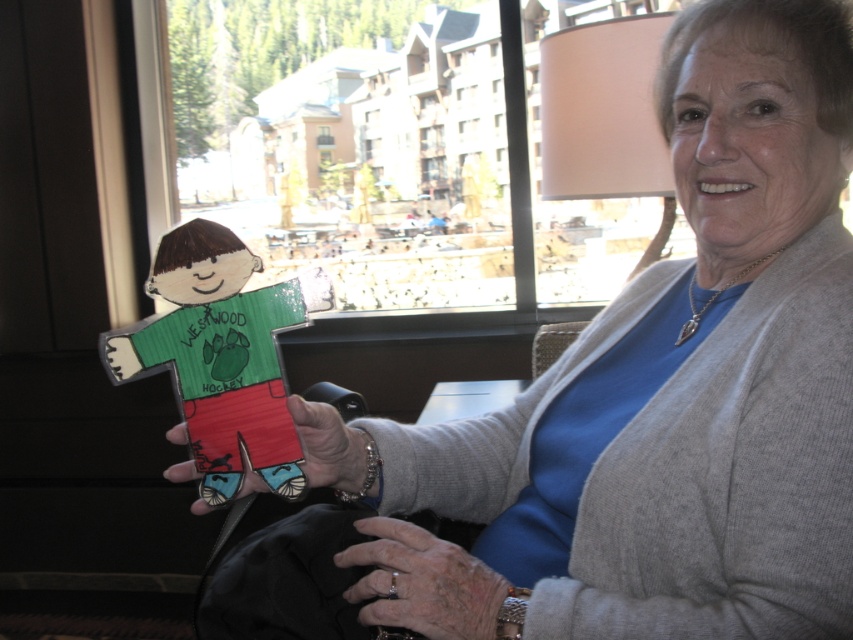
Question: Can you confirm if silver metallic ring at lower center is positioned to the left of matte cardboard figure at center?

Choices:
 (A) yes
 (B) no

Answer: (B)

Question: Which is farther from the cardboard figure at center?

Choices:
 (A) silver metallic ring at lower center
 (B) matte cardboard figure at center

Answer: (A)

Question: Does cardboard figure at center have a smaller size compared to matte cardboard figure at center?

Choices:
 (A) no
 (B) yes

Answer: (B)

Question: Which of the following is the farthest from the observer?

Choices:
 (A) (490, 634)
 (B) (251, 380)

Answer: (B)

Question: Can you confirm if cardboard figure at center is bigger than silver metallic ring at lower center?

Choices:
 (A) yes
 (B) no

Answer: (A)

Question: Which is farther from the matte cardboard figure at center?

Choices:
 (A) cardboard figure at center
 (B) silver metallic ring at lower center

Answer: (B)